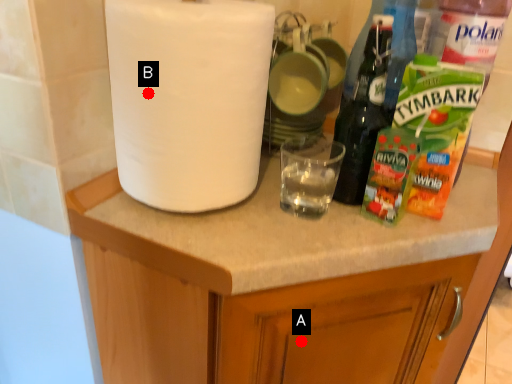
Question: Two points are circled on the image, labeled by A and B beside each circle. Which point is farther to the camera?

Choices:
 (A) A is further
 (B) B is further

Answer: (A)